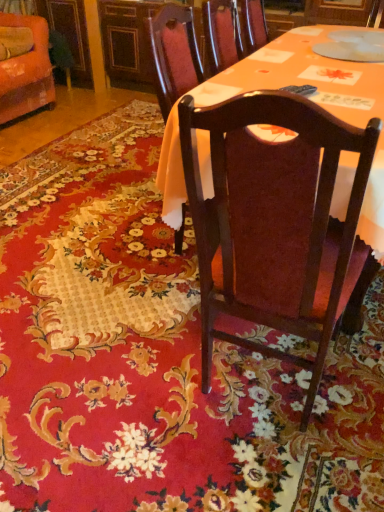
Question: From the image's perspective, relative to matte wood table at center, is dark wood chair at center, marked as the 1th chair in a right-to-left arrangement, above or below?

Choices:
 (A) below
 (B) above

Answer: (A)

Question: Looking at the image, does dark wood chair at center, the second chair from the top, seem bigger or smaller compared to matte wood table at center?

Choices:
 (A) small
 (B) big

Answer: (B)

Question: Estimate the real-world distances between objects in this image. Which object is farther from the dark wood chair at center, the second chair from the top?

Choices:
 (A) orange fabric chair at upper left, acting as the second chair starting from the bottom
 (B) matte wood table at center

Answer: (A)

Question: Considering the real-world distances, which object is farthest from the orange fabric chair at upper left, which is the 1th chair in left-to-right order?

Choices:
 (A) matte wood table at center
 (B) dark wood chair at center, the second chair from the top

Answer: (B)